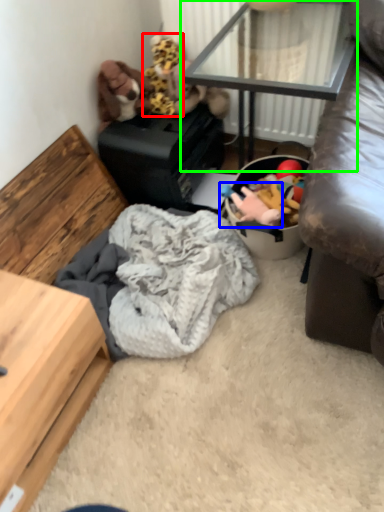
Question: Based on their relative distances, which object is farther from toy (highlighted by a red box)? Choose from toy (highlighted by a blue box) and table (highlighted by a green box).

Choices:
 (A) toy
 (B) table

Answer: (A)